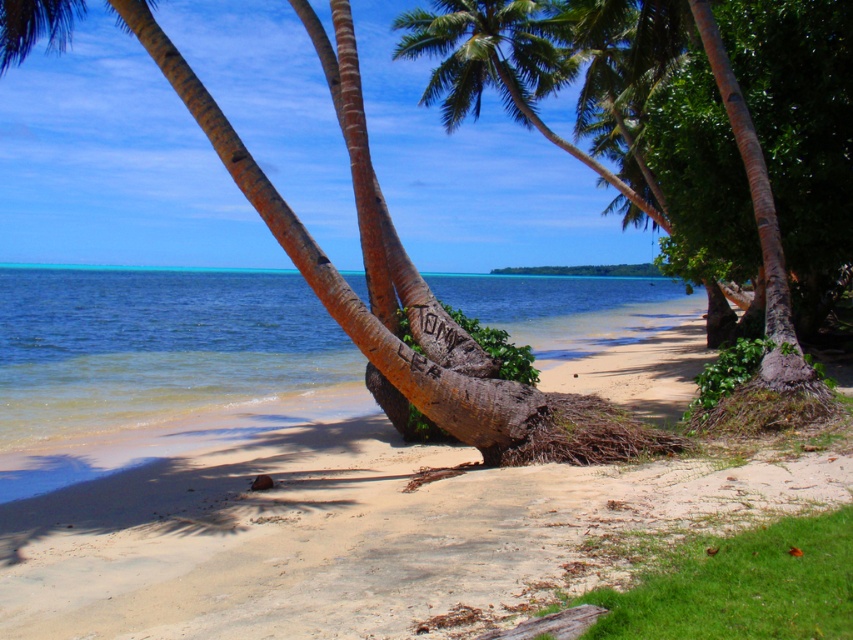
You are standing on the sandy beach at center and want to reach the clear blue water at center. Which direction should you walk to get to the water?

The sandy beach at center is on the right side of the clear blue water at center, so you should walk to the left to reach the water.

You are standing on the sandy beach at center and want to reach the clear blue water at center. Which direction should you move to get closer to the water?

Since the sandy beach at center is closer to the viewer than the clear blue water at center, you should move forward towards the water to get closer.